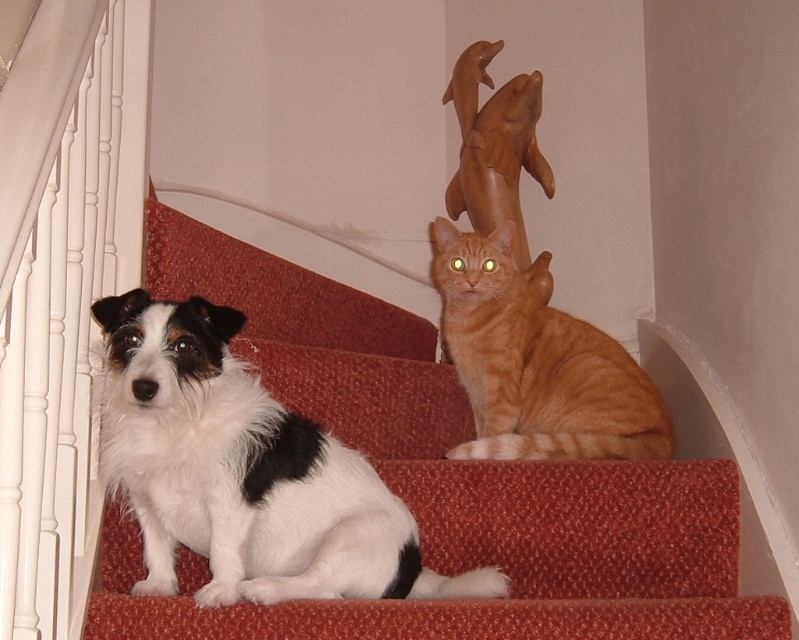
Measure the distance between point (110, 99) and camera.

Point (110, 99) is 5.27 feet from camera.

Between white painted wood at left and white-furred dog at lower left, which one has more height?

With more height is white painted wood at left.

Measure the distance between point (42, 310) and camera.

Point (42, 310) and camera are 3.71 feet apart from each other.

This screenshot has width=799, height=640. Find the location of `white painted wood at left`. white painted wood at left is located at coordinates (62, 289).

In the scene shown: Is carpeted stairs at center further to the viewer compared to white-furred dog at lower left?

Yes, carpeted stairs at center is further from the viewer.

I want to click on carpeted stairs at center, so click(440, 483).

Does point (372, 630) lie behind point (285, 483)?

No, (372, 630) is in front of (285, 483).

Identify the location of carpeted stairs at center. This screenshot has height=640, width=799. [x=440, y=483].

Does white painted wood at left appear over orange tabby cat at upper center?

Correct, white painted wood at left is located above orange tabby cat at upper center.

Does white painted wood at left have a lesser width compared to orange tabby cat at upper center?

Correct, white painted wood at left's width is less than orange tabby cat at upper center's.

Is point (22, 99) positioned after point (487, 305)?

No.

Locate an element on the screen. white painted wood at left is located at coordinates (62, 289).